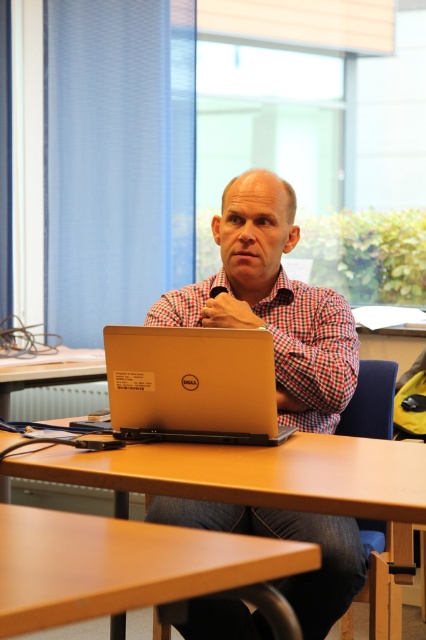
Identify the location of matte silver laptop at center. The height and width of the screenshot is (640, 426). (273, 301).

Looking at this image, who is shorter, matte silver laptop at center or checkered fabric shirt at center?

Standing shorter between the two is checkered fabric shirt at center.

Does point (310, 305) lie behind point (314, 381)?

Yes, point (310, 305) is behind point (314, 381).

Locate an element on the screen. Image resolution: width=426 pixels, height=640 pixels. matte silver laptop at center is located at coordinates (273, 301).

Who is more distant from viewer, (195, 544) or (175, 320)?

Positioned behind is point (175, 320).

Does brown wooden table at lower center appear over checkered fabric shirt at center?

Actually, brown wooden table at lower center is below checkered fabric shirt at center.

Is point (85, 582) in front of point (262, 300)?

Yes, it is.

The image size is (426, 640). I want to click on brown wooden table at lower center, so click(120, 564).

This screenshot has height=640, width=426. What do you see at coordinates (273, 301) in the screenshot?
I see `matte silver laptop at center` at bounding box center [273, 301].

Is point (278, 417) more distant than point (106, 572)?

Yes, it is.

Where is `matte silver laptop at center`? The width and height of the screenshot is (426, 640). matte silver laptop at center is located at coordinates [x=273, y=301].